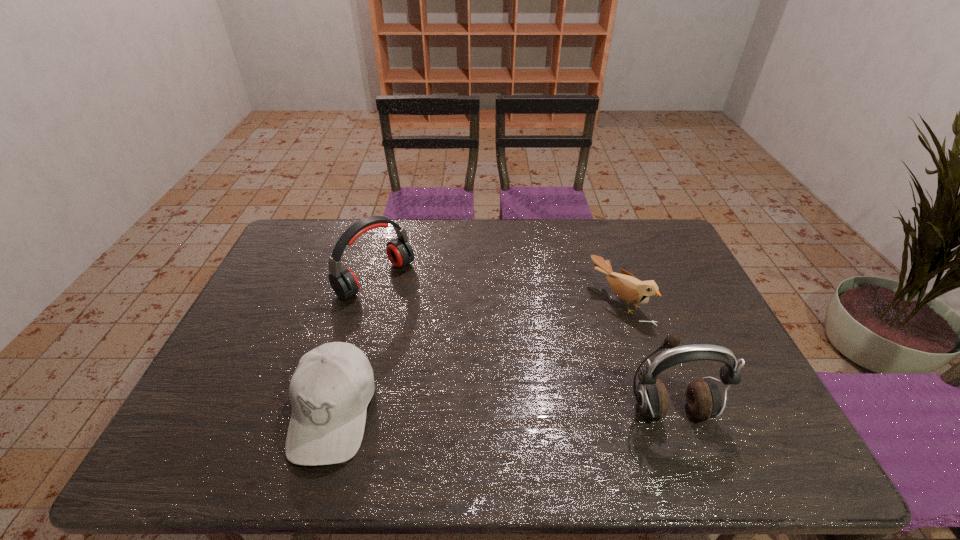
At what (x,y) coordinates should I click in order to perform the action: click on baseball cap. Please return your answer as a coordinate pair (x, y). The image size is (960, 540). Looking at the image, I should click on (330, 390).

Image resolution: width=960 pixels, height=540 pixels. I want to click on the right earphone, so click(x=703, y=397).

Find the location of a particular element. Image resolution: width=960 pixels, height=540 pixels. the nearer earphone is located at coordinates (703, 397).

Locate an element on the screen. The width and height of the screenshot is (960, 540). bird is located at coordinates (630, 289).

Identify the location of the second tallest object. The width and height of the screenshot is (960, 540). (343, 281).

Locate an element on the screen. the farther earphone is located at coordinates (343, 281).

Identify the location of vacant space located at the beak of the bird. (500, 387).

The height and width of the screenshot is (540, 960). I want to click on vacant space located at the beak of the bird, so click(x=576, y=335).

Find the location of a particular element. free location located 0.380m at the beak of the bird is located at coordinates (503, 384).

Image resolution: width=960 pixels, height=540 pixels. In order to click on free space located on the ear cups of the shorter earphone in this screenshot , I will do `click(434, 325)`.